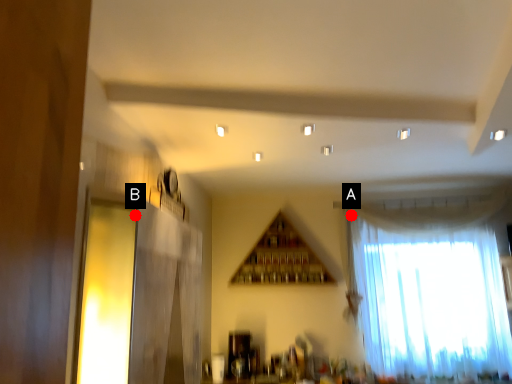
Question: Two points are circled on the image, labeled by A and B beside each circle. Which point is farther to the camera?

Choices:
 (A) A is further
 (B) B is further

Answer: (A)